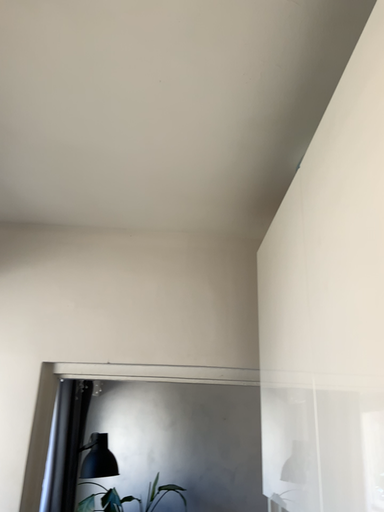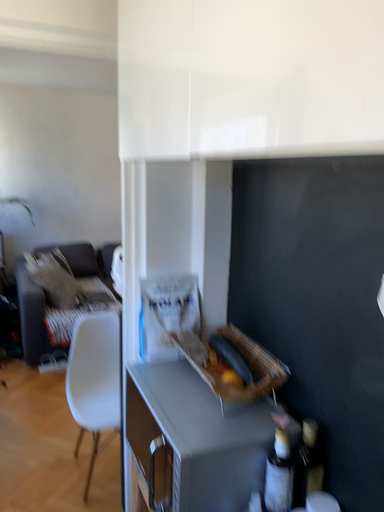
Question: Which way did the camera rotate in the video?

Choices:
 (A) rotated upward
 (B) rotated downward

Answer: (B)